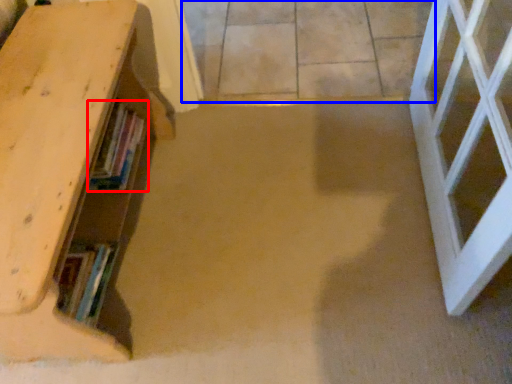
Question: Among these objects, which one is nearest to the camera, book (highlighted by a red box) or concrete (highlighted by a blue box)?

Choices:
 (A) book
 (B) concrete

Answer: (A)